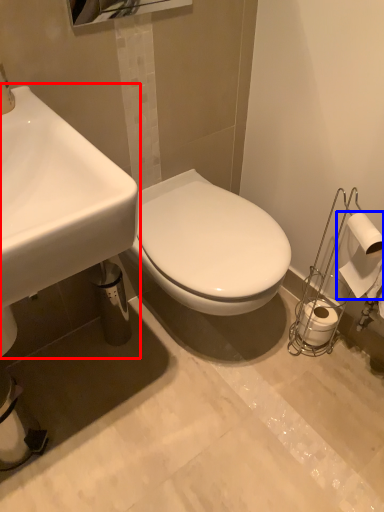
Question: Which object appears farthest to the camera in this image, sink (highlighted by a red box) or toilet paper (highlighted by a blue box)?

Choices:
 (A) sink
 (B) toilet paper

Answer: (B)